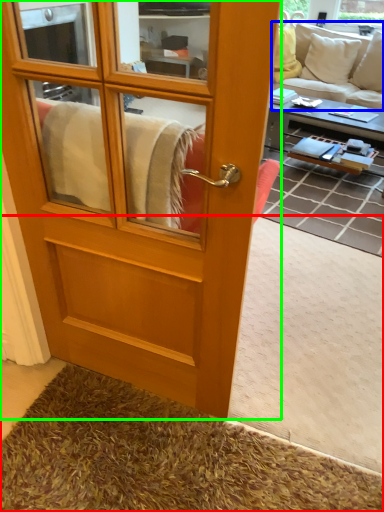
Question: Which object is the farthest from carpets (highlighted by a red box)? Choose among these: studio couch (highlighted by a blue box) or screen door (highlighted by a green box).

Choices:
 (A) studio couch
 (B) screen door

Answer: (A)